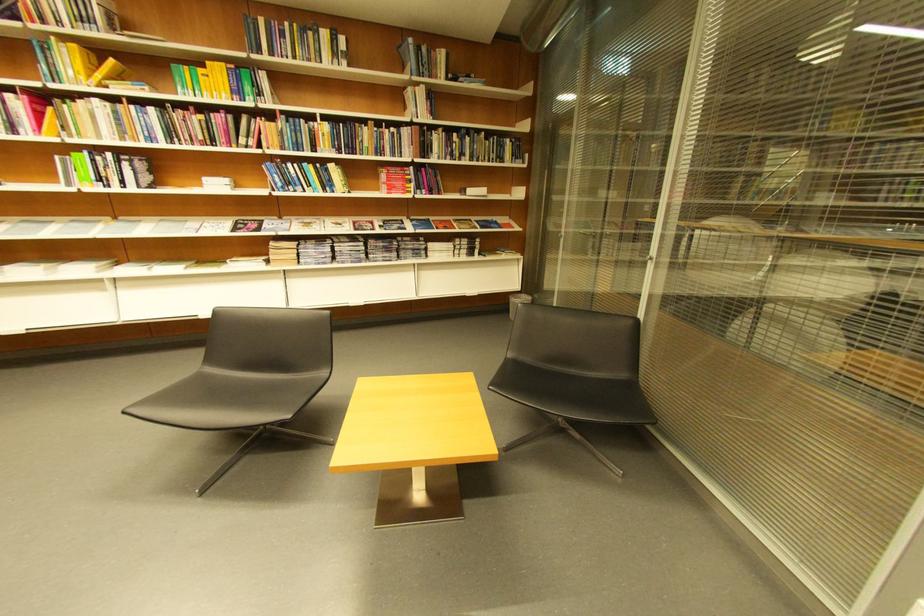
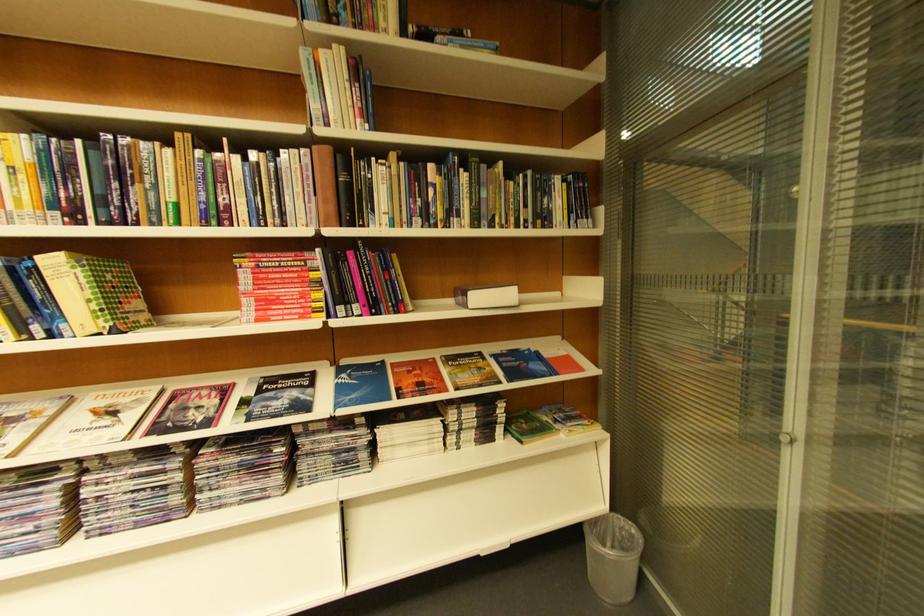
Question: What movement of the cameraman would produce the second image?

Choices:
 (A) Left
 (B) Right
 (C) Forward
 (D) Backward

Answer: (C)